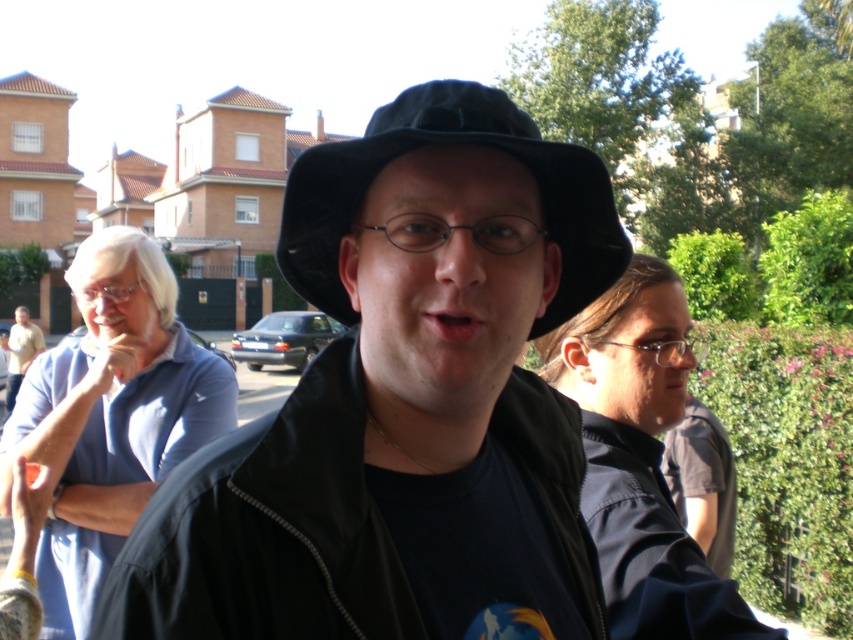
Question: Which point appears farthest from the camera in this image?

Choices:
 (A) (13, 369)
 (B) (587, 525)
 (C) (444, 321)
 (D) (561, 538)

Answer: (A)

Question: Where is black fabric fedora at center located in relation to matte yellow shirt at left in the image?

Choices:
 (A) above
 (B) below

Answer: (A)

Question: Which point appears closest to the camera in this image?

Choices:
 (A) (113, 349)
 (B) (393, 612)
 (C) (554, 369)
 (D) (456, 301)

Answer: (B)

Question: Estimate the real-world distances between objects in this image. Which object is farther from the blue cotton shirt at left?

Choices:
 (A) matte yellow shirt at left
 (B) matte black jacket at center

Answer: (A)

Question: In this image, where is black fabric fedora at center located relative to pink matte lips at center?

Choices:
 (A) below
 (B) above

Answer: (B)

Question: Does black fabric fedora at center appear under pink matte lips at center?

Choices:
 (A) no
 (B) yes

Answer: (A)